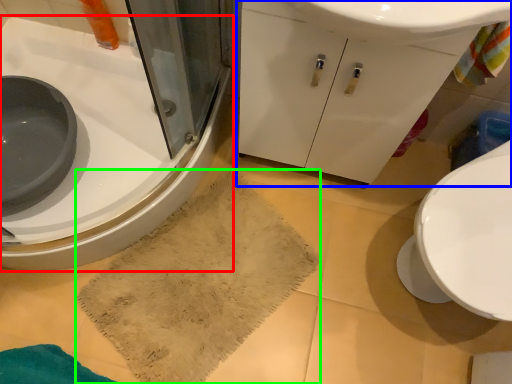
Question: Which is farther away from sink (highlighted by a red box)? bathroom cabinet (highlighted by a blue box) or bath towel (highlighted by a green box)?

Choices:
 (A) bathroom cabinet
 (B) bath towel

Answer: (A)